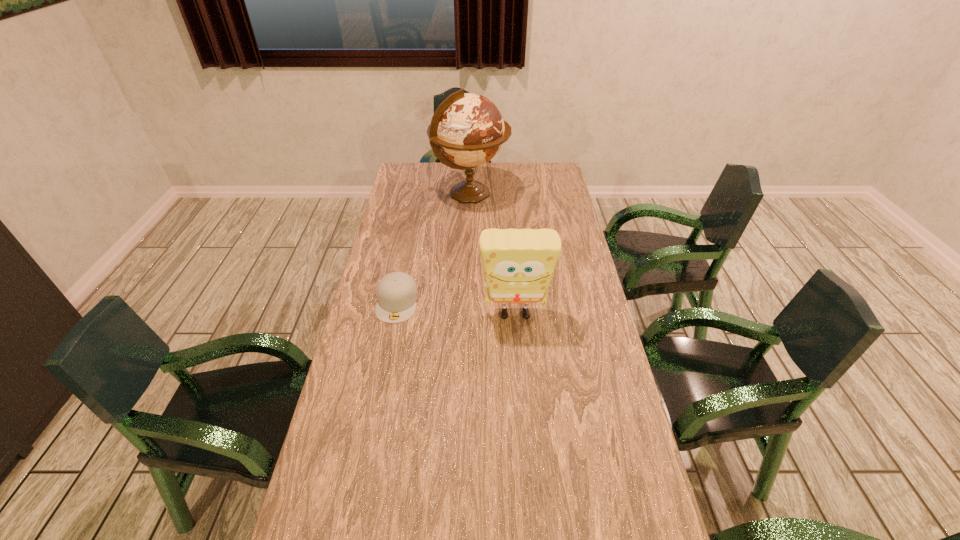
This screenshot has width=960, height=540. I want to click on blank space at the far edge of the desktop, so click(479, 167).

This screenshot has width=960, height=540. In order to click on vacant region at the left edge of the desktop in this screenshot , I will do `click(425, 204)`.

The image size is (960, 540). In order to click on vacant space at the right edge of the desktop in this screenshot , I will do `click(606, 366)`.

I want to click on free space at the far right corner of the desktop, so click(x=531, y=187).

Where is `unoccupied position between the shortest object and the globe`? This screenshot has width=960, height=540. unoccupied position between the shortest object and the globe is located at coordinates (434, 248).

Identify the location of vacant space that is in between the farthest object and the shortest object. This screenshot has height=540, width=960. (434, 248).

You are a GUI agent. You are given a task and a screenshot of the screen. Output one action in this format:
    pyautogui.click(x=<x>, y=<y>)
    Task: Click on the vacant space that's between the cap and the sponge
    The width and height of the screenshot is (960, 540).
    Given the screenshot: What is the action you would take?
    pyautogui.click(x=456, y=308)

Where is `vacant space that's between the globe and the cap`? This screenshot has width=960, height=540. vacant space that's between the globe and the cap is located at coordinates (434, 248).

Locate an element on the screen. Image resolution: width=960 pixels, height=540 pixels. free space that is in between the shortest object and the tallest object is located at coordinates (434, 248).

Choose which object is the nearest neighbor to the shortest object. Please provide its 2D coordinates. Your answer should be formatted as a tuple, i.e. [(x, y)], where the tuple contains the x and y coordinates of a point satisfying the conditions above.

[(518, 264)]